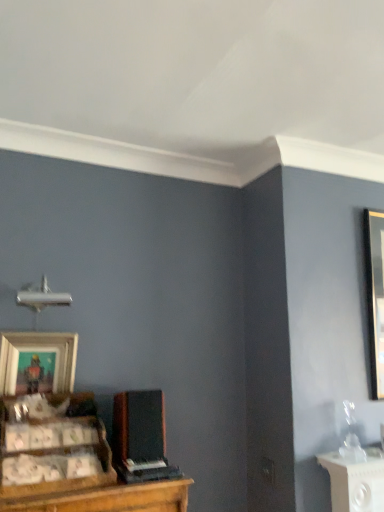
Question: Considering the positions of point (46, 339) and point (129, 449), is point (46, 339) closer or farther from the camera than point (129, 449)?

Choices:
 (A) closer
 (B) farther

Answer: (B)

Question: From the image's perspective, relative to black matte speaker at center, is wooden picture frame at lower left above or below?

Choices:
 (A) above
 (B) below

Answer: (A)

Question: Considering the real-world distances, which object is farthest from the black matte speaker at center?

Choices:
 (A) wooden picture frame at lower left
 (B) wooden cabinet at lower left

Answer: (A)

Question: Which object is the farthest from the wooden cabinet at lower left?

Choices:
 (A) wooden picture frame at lower left
 (B) black matte speaker at center

Answer: (A)